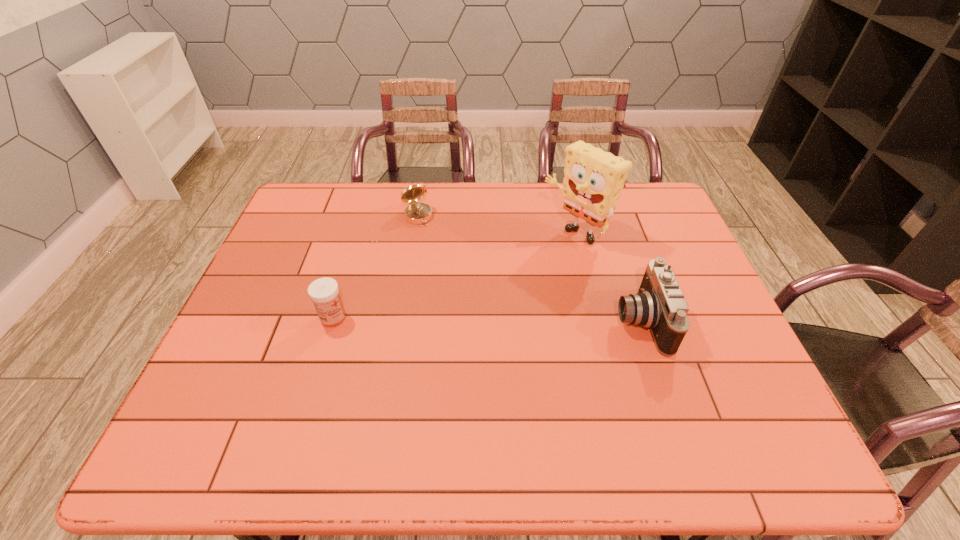
I want to click on free space on the desktop that is between the medicine and the third shortest object and is positioned with the dial facing the second object from left to right, so click(x=479, y=319).

Where is `free space on the desktop that is between the leftmost object and the second tallest object and is positioned on the face of the sponge`? The width and height of the screenshot is (960, 540). free space on the desktop that is between the leftmost object and the second tallest object and is positioned on the face of the sponge is located at coordinates (459, 319).